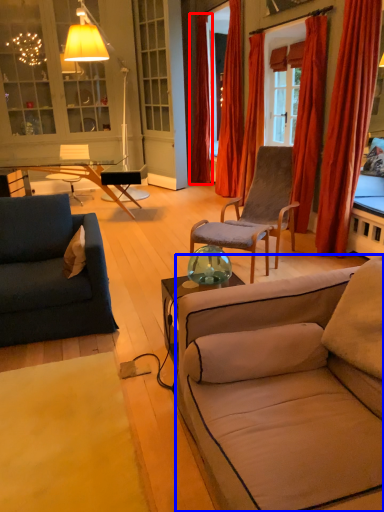
Question: Which point is further to the camera, curtain (highlighted by a red box) or studio couch (highlighted by a blue box)?

Choices:
 (A) curtain
 (B) studio couch

Answer: (A)